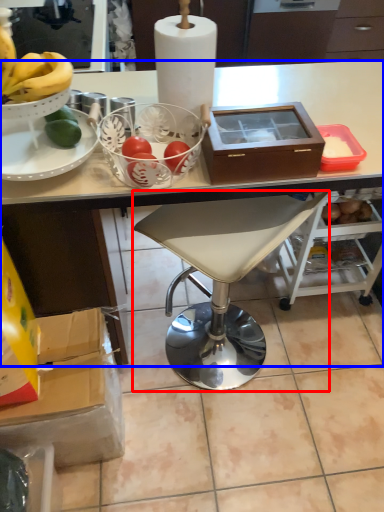
Question: Which object appears closest to the camera in this image, chair (highlighted by a red box) or desk (highlighted by a blue box)?

Choices:
 (A) chair
 (B) desk

Answer: (B)